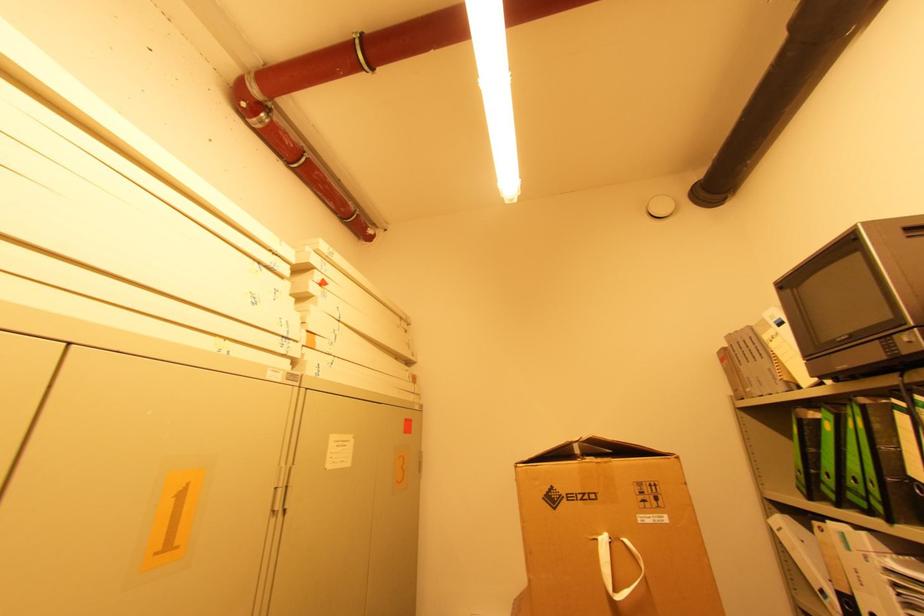
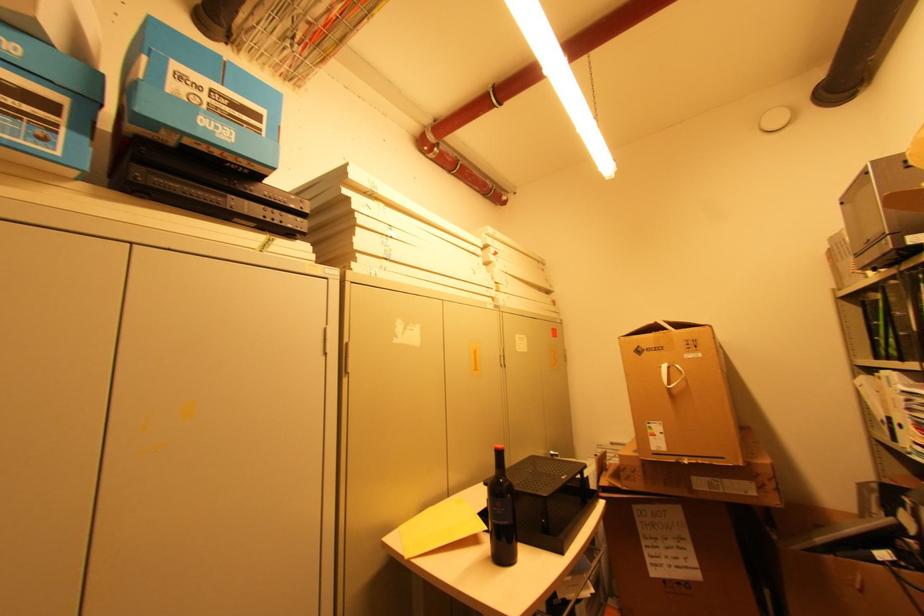
Where in the second image is the point corresponding to pixel 822 476 from the first image?

(881, 341)